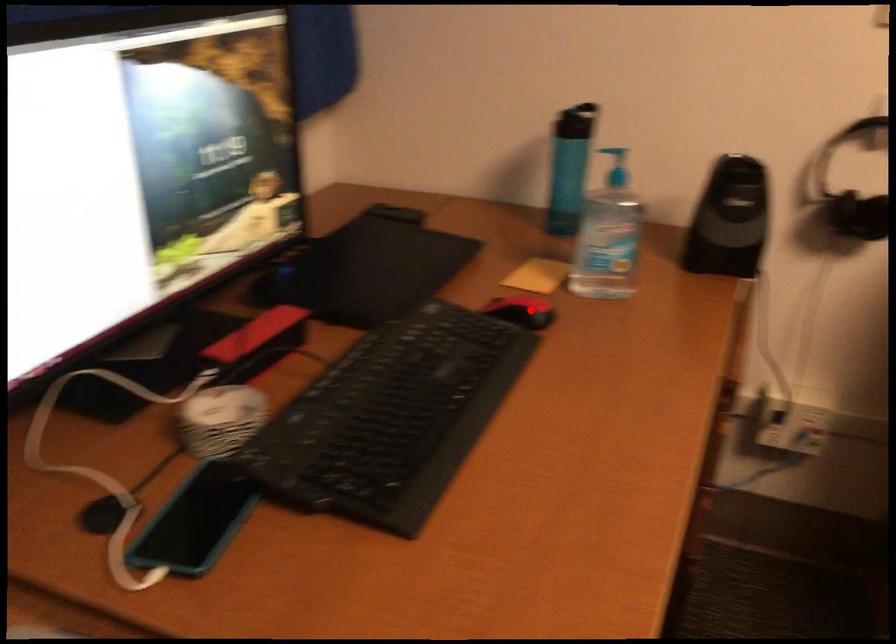
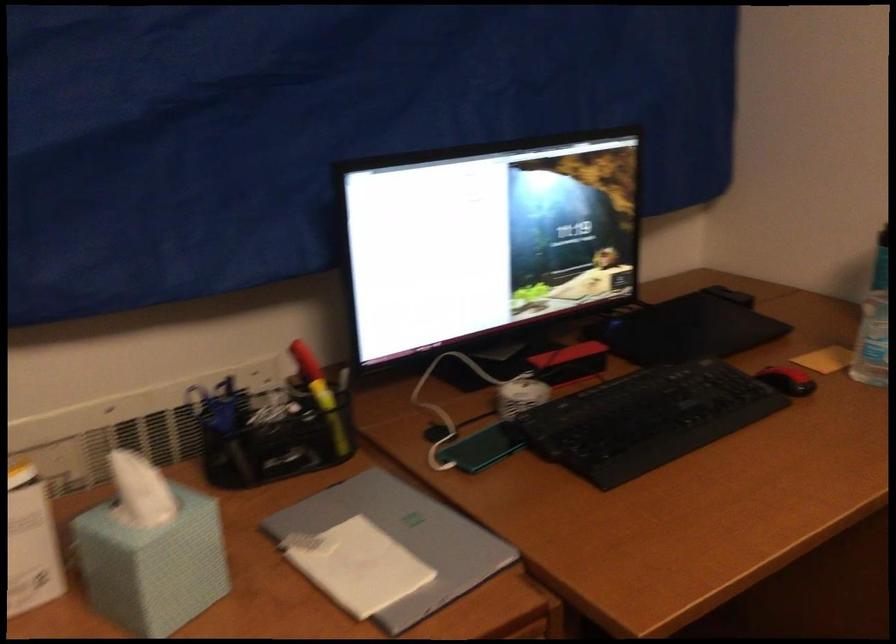
Question: I am providing you with two images of the same scene from different viewpoints. Image1 has a red point marked. In image2, the corresponding 3D location appears at what relative position? Reply with the corresponding letter.

Choices:
 (A) Closer
 (B) Farther

Answer: (B)